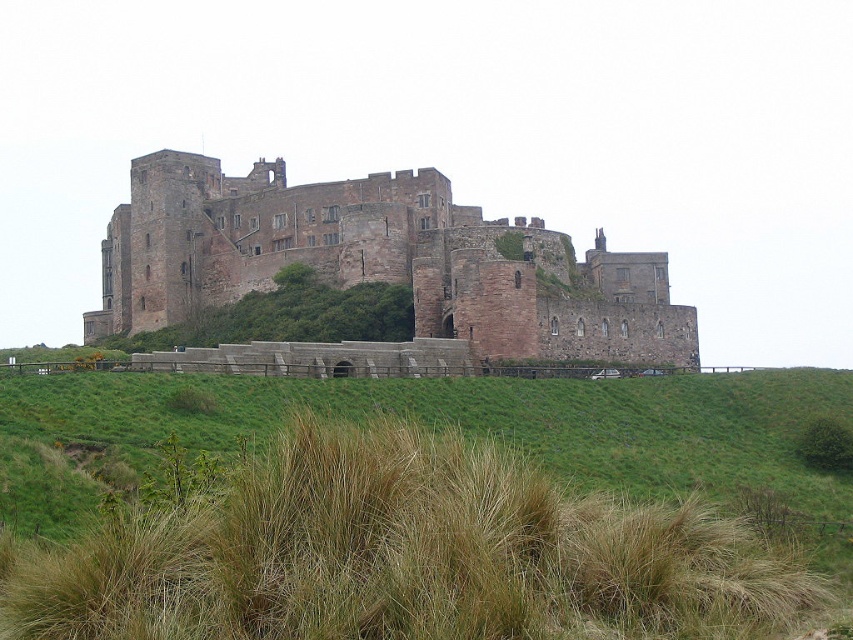
In the scene shown: Which is more to the right, brown stone castle at center or green grass at lower center?

green grass at lower center

What do you see at coordinates (381, 262) in the screenshot?
I see `brown stone castle at center` at bounding box center [381, 262].

Between point (428, 232) and point (546, 436), which one is positioned behind?

The point (428, 232) is behind.

Find the location of a particular element. This screenshot has width=853, height=640. brown stone castle at center is located at coordinates (381, 262).